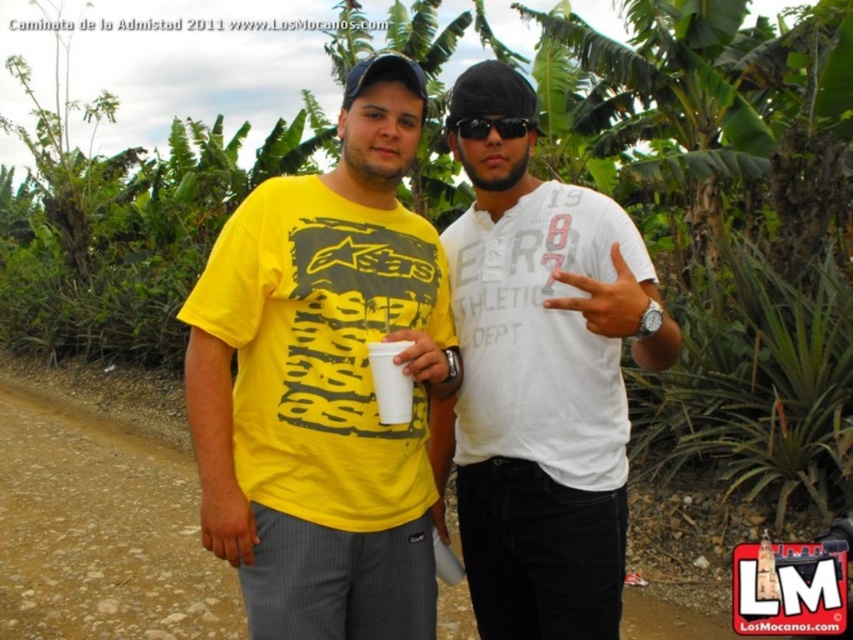
Based on the photo, you are a photographer trying to capture both the white cotton shirt at center and the white paper cup at center in a single frame. Considering their sizes, which object should you focus on to ensure both are clearly visible in the photo?

The white cotton shirt at center has a larger size compared to the white paper cup at center, so you should focus on the white cotton shirt at center to ensure both are clearly visible in the photo.

You are planning to take a photo of the white cotton shirt at center and the brown dirt track at lower left. Which object should you focus on first if you want to capture both in the frame without moving the camera?

The white cotton shirt at center should be focused on first because it occupies less space than the brown dirt track at lower left, allowing more flexibility to adjust the framing to include both objects without moving the camera.

You are a photographer trying to capture a group photo of the two people in the scene. The person wearing the white cotton shirt at center is standing exactly at point 0.616, 0.638. Where should you position yourself to ensure both individuals are in frame?

To ensure both individuals are in frame, position yourself so that the white cotton shirt at center is at point (543, 394), as this central position will help balance the composition and include both subjects within the camera frame.